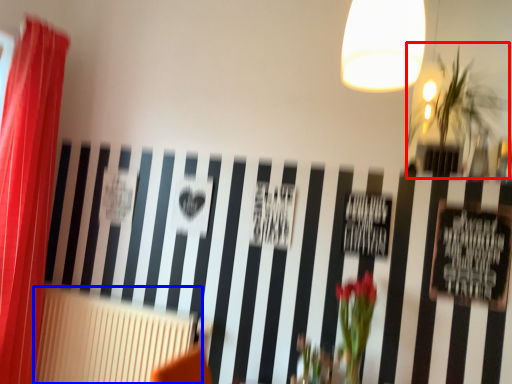
Question: Which object is closer to the camera taking this photo, plant (highlighted by a red box) or radiator (highlighted by a blue box)?

Choices:
 (A) plant
 (B) radiator

Answer: (A)